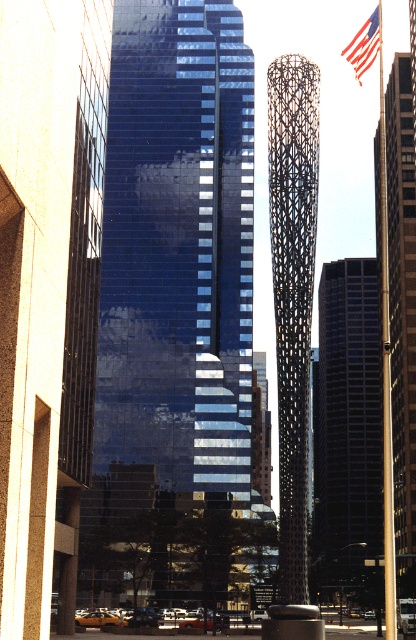
Can you confirm if polished glass tower at center is wider than american flag at upper right?

Incorrect, polished glass tower at center's width does not surpass american flag at upper right's.

Does polished glass tower at center come behind american flag at upper right?

That is True.

I want to click on polished glass tower at center, so click(401, 300).

Is point (364, 260) positioned before point (279, 436)?

No, it is behind (279, 436).

From the picture: Who is taller, dark blue glass skyscraper at center or black textured sculpture at center?

black textured sculpture at center is taller.

The image size is (416, 640). Describe the element at coordinates (346, 428) in the screenshot. I see `dark blue glass skyscraper at center` at that location.

Where is `dark blue glass skyscraper at center`? dark blue glass skyscraper at center is located at coordinates (346, 428).

Does dark blue glass skyscraper at center appear on the right side of american flag at upper right?

Yes, dark blue glass skyscraper at center is to the right of american flag at upper right.

Who is taller, dark blue glass skyscraper at center or american flag at upper right?

dark blue glass skyscraper at center

Where is `dark blue glass skyscraper at center`? The image size is (416, 640). dark blue glass skyscraper at center is located at coordinates (346, 428).

The image size is (416, 640). I want to click on dark blue glass skyscraper at center, so click(x=346, y=428).